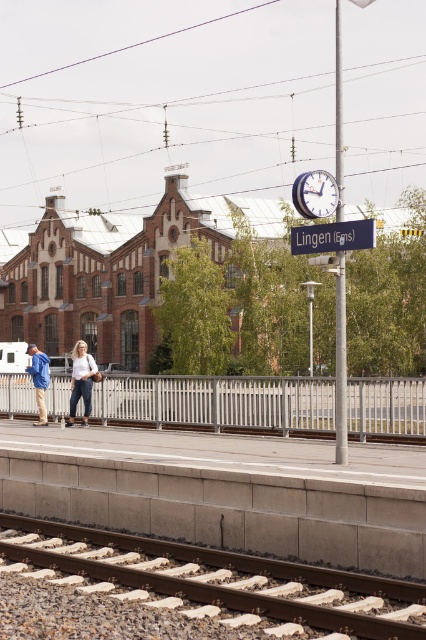
From the picture: Is brown wooden track at lower center to the right of blue denim jacket at left from the viewer's perspective?

Indeed, brown wooden track at lower center is positioned on the right side of blue denim jacket at left.

You are a GUI agent. You are given a task and a screenshot of the screen. Output one action in this format:
    pyautogui.click(x=<x>, y=<y>)
    Task: Click on the brown wooden track at lower center
    
    Given the screenshot: What is the action you would take?
    pyautogui.click(x=209, y=582)

Who is shorter, gray metallic rail at center or blue denim jacket at left?

Standing shorter between the two is gray metallic rail at center.

Can you confirm if gray metallic rail at center is positioned to the left of blue denim jacket at left?

No, gray metallic rail at center is not to the left of blue denim jacket at left.

Is point (271, 385) in front of point (43, 372)?

That is True.

This screenshot has height=640, width=426. I want to click on gray metallic rail at center, so click(218, 403).

In the scene shown: Is matte blue jacket at center closer to camera compared to blue denim jacket at left?

Yes, it is in front of blue denim jacket at left.

Can you confirm if matte blue jacket at center is positioned to the right of blue denim jacket at left?

Incorrect, matte blue jacket at center is not on the right side of blue denim jacket at left.

Image resolution: width=426 pixels, height=640 pixels. Describe the element at coordinates (80, 380) in the screenshot. I see `matte blue jacket at center` at that location.

This screenshot has height=640, width=426. What are the coordinates of `matte blue jacket at center` in the screenshot? It's located at (80, 380).